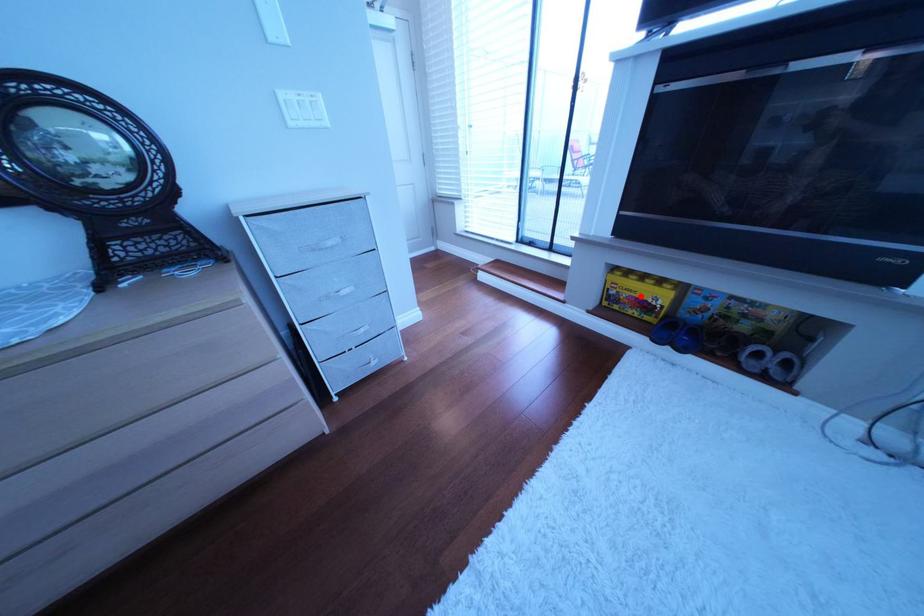
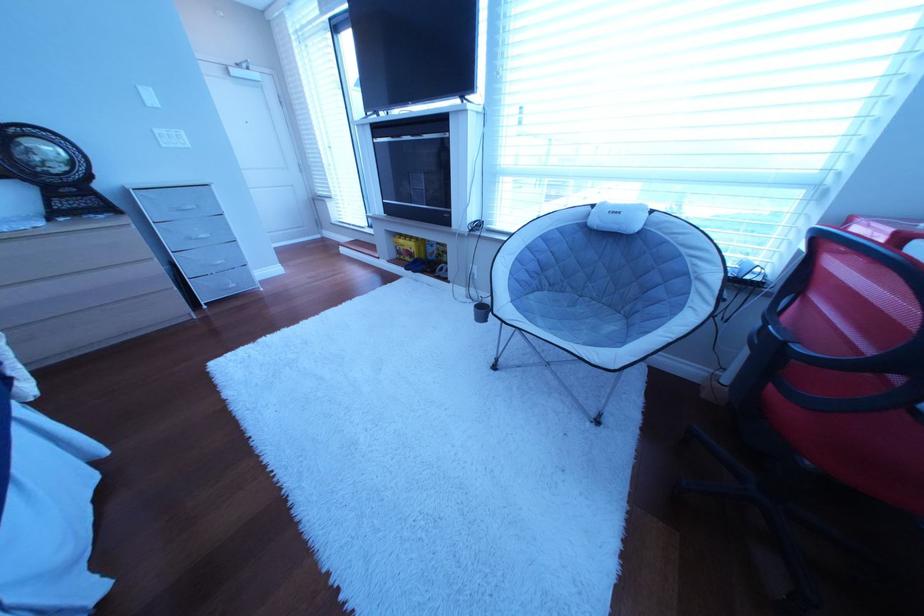
The point at the highlighted location is marked in the first image. Where is the corresponding point in the second image?

(418, 251)